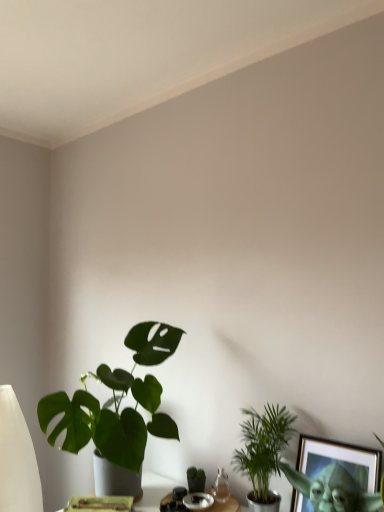
Question: Is point (124, 423) closer or farther from the camera than point (198, 481)?

Choices:
 (A) farther
 (B) closer

Answer: (B)

Question: Considering the positions of green matte plant at lower left, which is the 1th houseplant from left to right, and green matte houseplant at center, which ranks as the second houseplant in left-to-right order, in the image, is green matte plant at lower left, which is the 1th houseplant from left to right, bigger or smaller than green matte houseplant at center, which ranks as the second houseplant in left-to-right order,?

Choices:
 (A) big
 (B) small

Answer: (A)

Question: Which object is positioned farthest from the green matte plant at lower left, which is the 1th houseplant from left to right?

Choices:
 (A) green leafy plant at lower right, which appears as the 1th houseplant when viewed from the right
 (B) gold-framed picture at lower right
 (C) green matte houseplant at center, the 2th houseplant from the right

Answer: (B)

Question: Which is nearer to the gold-framed picture at lower right?

Choices:
 (A) green matte plant at lower left, the 3th houseplant when ordered from right to left
 (B) green matte houseplant at center, which ranks as the second houseplant in left-to-right order
 (C) green leafy plant at lower right, the 3th houseplant when ordered from left to right

Answer: (C)